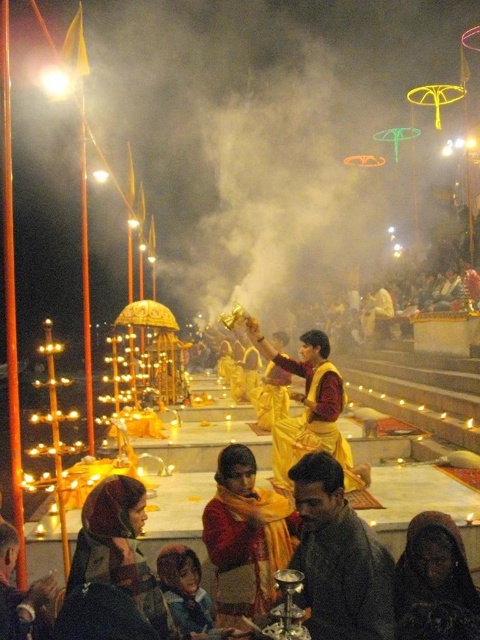
Question: In this image, where is yellow fabric shawl at center located relative to dark fabric headscarf at lower right?

Choices:
 (A) below
 (B) above

Answer: (A)

Question: Which of the following is the closest to the observer?

Choices:
 (A) (323, 554)
 (B) (349, 474)

Answer: (A)

Question: Which object appears farthest from the camera in this image?

Choices:
 (A) dark brown fabric robe at center
 (B) dark fabric headscarf at lower right

Answer: (A)

Question: Is yellow fabric shawl at center bigger than dark fabric headscarf at lower right?

Choices:
 (A) no
 (B) yes

Answer: (B)

Question: From the image, what is the correct spatial relationship of dark fabric headscarf at lower right in relation to yellow silk robe at center?

Choices:
 (A) below
 (B) above

Answer: (A)

Question: Estimate the real-world distances between objects in this image. Which object is closer to the dark fabric headscarf at lower right?

Choices:
 (A) dark brown fabric robe at center
 (B) yellow fabric shawl at center

Answer: (A)